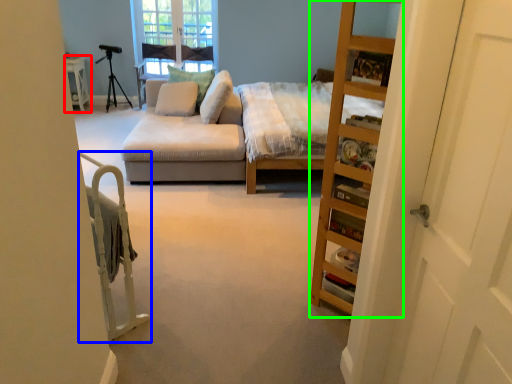
Question: Which object is the farthest from table (highlighted by a red box)? Choose among these: bed frame (highlighted by a blue box) or cabinet (highlighted by a green box).

Choices:
 (A) bed frame
 (B) cabinet

Answer: (B)